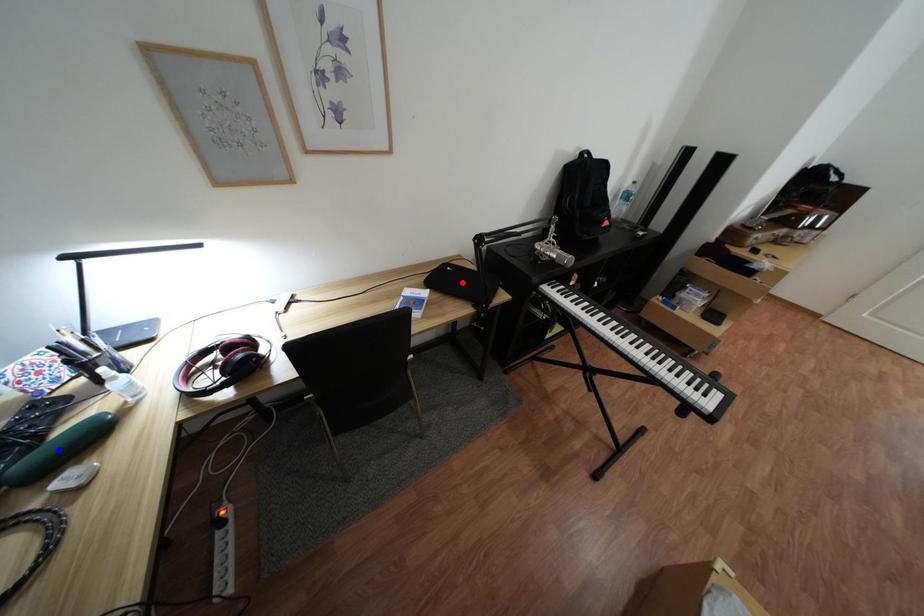
Question: Which of the two points in the image is closer to the camera?

Choices:
 (A) Blue point is closer.
 (B) Red point is closer.

Answer: (A)